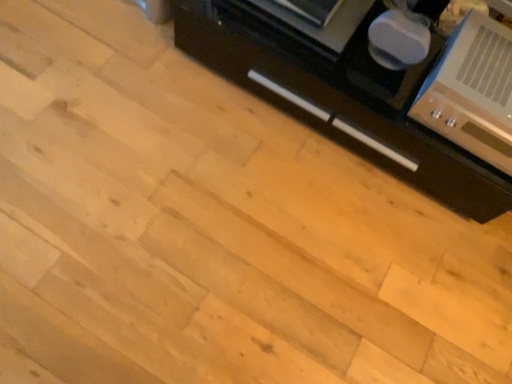
Where is `vacant space in front of black matte cabinet at right`? This screenshot has width=512, height=384. vacant space in front of black matte cabinet at right is located at coordinates (273, 242).